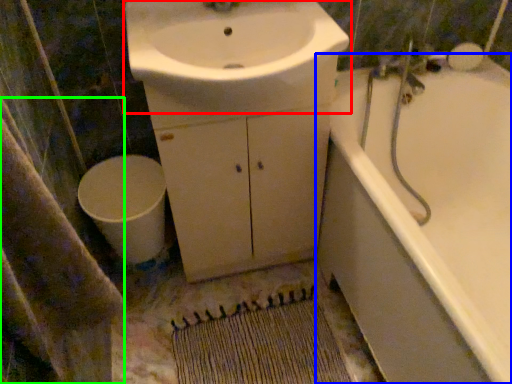
Question: Considering the real-world distances, which object is closest to sink (highlighted by a red box)? bathtub (highlighted by a blue box) or bath towel (highlighted by a green box).

Choices:
 (A) bathtub
 (B) bath towel

Answer: (A)